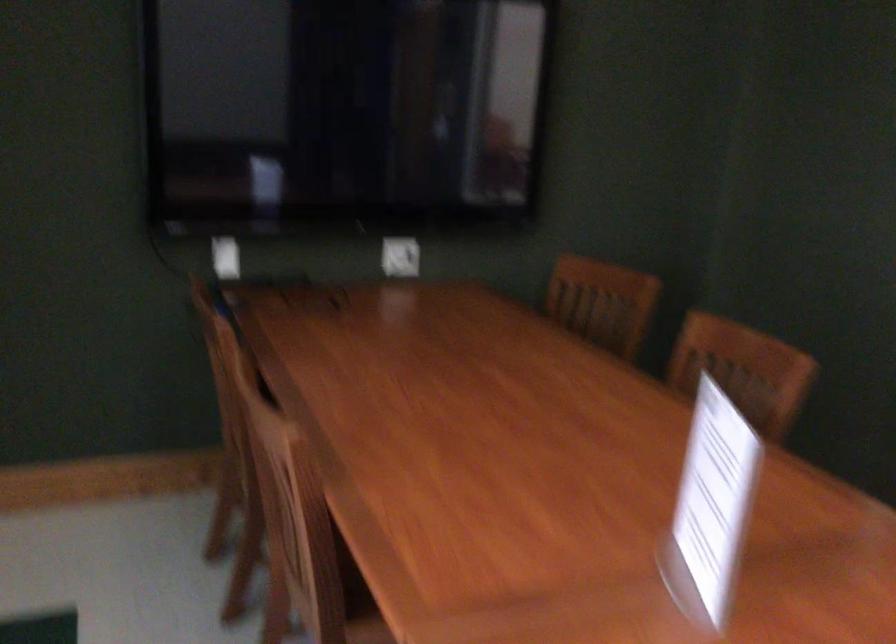
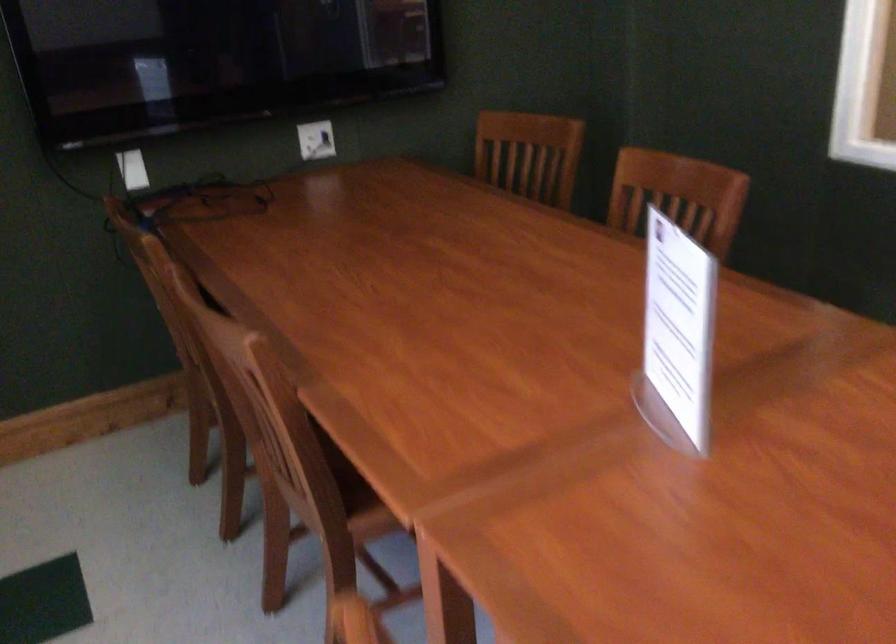
In the second image, find the point that corresponds to point 323,516 in the first image.

(299, 413)